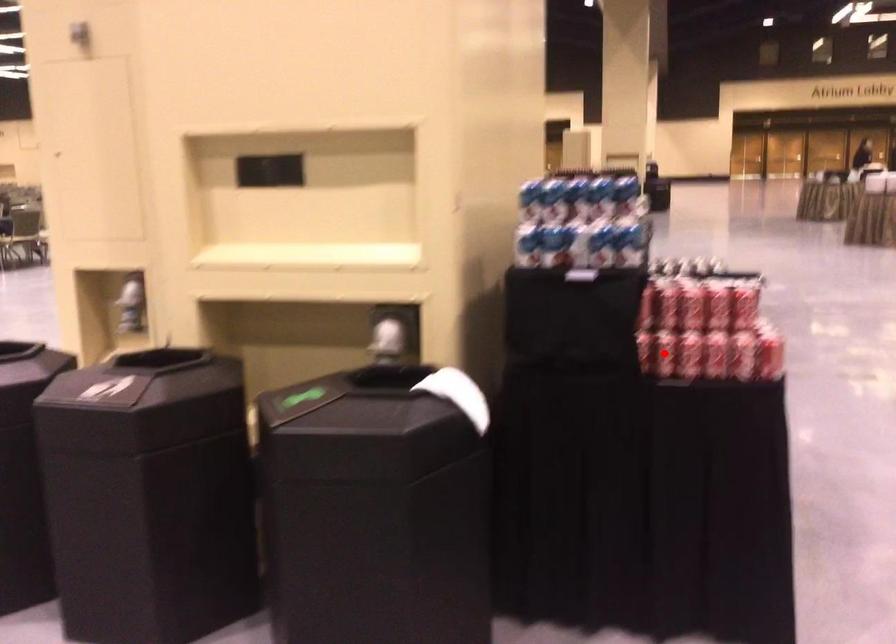
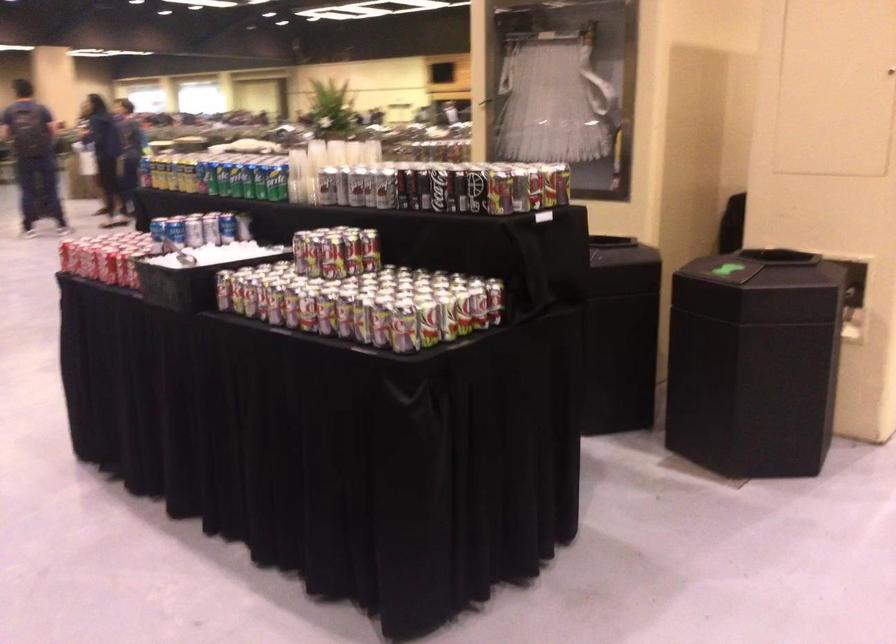
Question: I am providing you with two images of the same scene from different viewpoints. A red point is marked on the first image. Can you still see the location of the red point in image 2?

Choices:
 (A) Yes
 (B) No

Answer: (B)